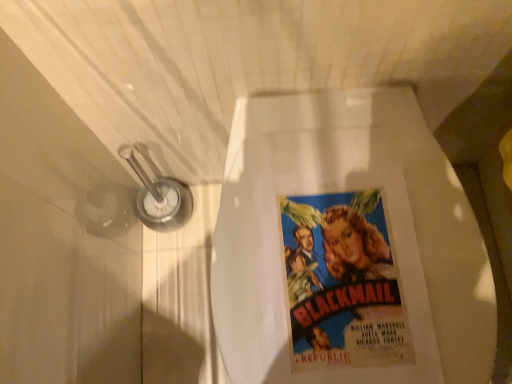
The image size is (512, 384). What are the coordinates of `free spot above matte paper poster at center (from a real-world perspective)` in the screenshot? It's located at (351, 238).